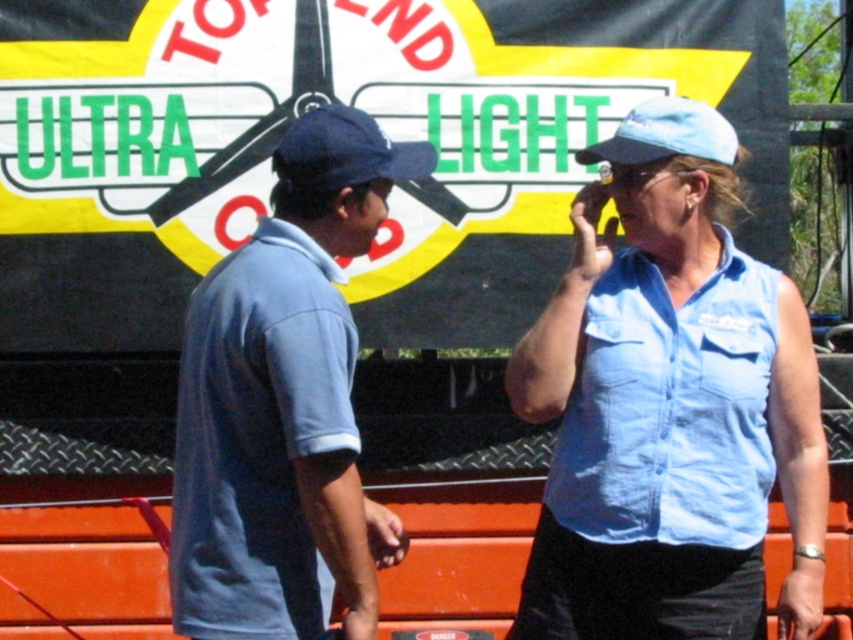
Who is taller, matte blue polo shirt at left or light blue button-up shirt at right?

matte blue polo shirt at left is taller.

Measure the distance between matte blue polo shirt at left and light blue button-up shirt at right.

matte blue polo shirt at left and light blue button-up shirt at right are 22.31 inches apart from each other.

Image resolution: width=853 pixels, height=640 pixels. In order to click on matte blue polo shirt at left in this screenshot , I will do `click(283, 403)`.

Where is `matte blue polo shirt at left`? matte blue polo shirt at left is located at coordinates (283, 403).

Does light blue button-up shirt at right have a smaller size compared to navy blue fabric baseball cap at upper center?

No.

Between point (585, 532) and point (300, 156), which one is positioned in front?

Point (300, 156)

Find the location of a particular element. The height and width of the screenshot is (640, 853). light blue button-up shirt at right is located at coordinates (670, 408).

Is light blue denim shirt at center positioned at the back of blue fabric baseball cap at upper right?

No.

Is point (622, 504) positioned before point (735, 141)?

Yes, it is in front of point (735, 141).

Where is `light blue denim shirt at center`? The width and height of the screenshot is (853, 640). light blue denim shirt at center is located at coordinates (669, 406).